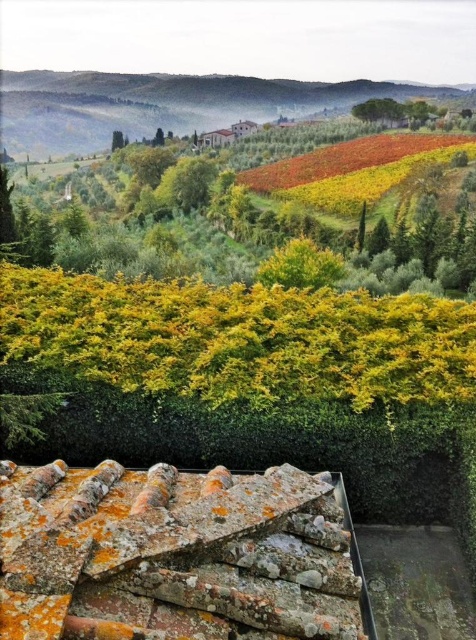
You are a landscape architect planning to install a new pathway between the rusty terracotta tiles at center and the green grassy hillside at upper center. The pathway requires a minimum distance of 150 meters to accommodate all the planned features. Based on the scene, will the available space between them be sufficient?

The rusty terracotta tiles at center is 170.53 meters away from the green grassy hillside at upper center, which exceeds the required 150 meters. Therefore, the available space is sufficient for the pathway.

You are planning to build a small garden shed on the green grassy hillside at upper center and the green leafy tree at center. Which location would be more elevated and thus have a better view of the surrounding countryside?

The green grassy hillside at upper center has a greater height compared to the green leafy tree at center, so building the shed there would provide a better view of the surrounding countryside.

You are a gardener who wants to plant a row of lavender plants between the rusty terracotta tiles at center and the hedge. The lavender plants need at least 3 meters of space between them to grow properly. Do you think there is enough space between them?

The rusty terracotta tiles at center and the hedge are 3.68 meters apart. Since the lavender plants require at least 3 meters of space, there is enough room to plant them between the two.